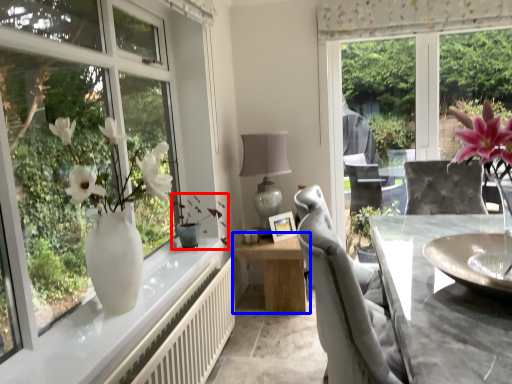
Question: Which object appears closest to the camera in this image, plant (highlighted by a red box) or table (highlighted by a blue box)?

Choices:
 (A) plant
 (B) table

Answer: (A)